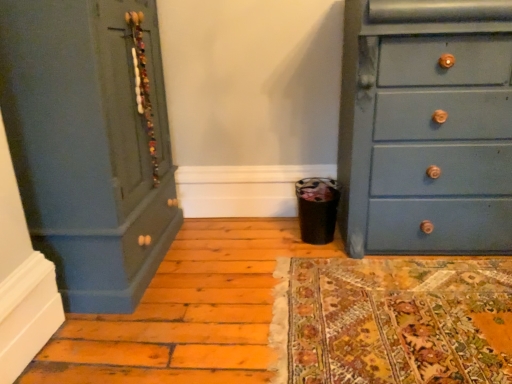
Question: Looking at the image, does matte blue dresser at right, placed as the second chest of drawers when sorted from left to right, seem bigger or smaller compared to matte blue dresser at left, positioned as the 2th chest of drawers in right-to-left order?

Choices:
 (A) big
 (B) small

Answer: (B)

Question: In terms of height, does matte blue dresser at right, marked as the first chest of drawers in a right-to-left arrangement, look taller or shorter compared to matte blue dresser at left, positioned as the 2th chest of drawers in right-to-left order?

Choices:
 (A) tall
 (B) short

Answer: (B)

Question: Relative to matte blue dresser at left, the 1th chest of drawers in the left-to-right sequence, is matte blue dresser at right, placed as the second chest of drawers when sorted from left to right, in front or behind?

Choices:
 (A) behind
 (B) front

Answer: (A)

Question: Considering the positions of point (31, 16) and point (463, 18), is point (31, 16) closer or farther from the camera than point (463, 18)?

Choices:
 (A) closer
 (B) farther

Answer: (A)

Question: In the image, is matte blue dresser at left, positioned as the 2th chest of drawers in right-to-left order, positioned in front of or behind matte blue dresser at right, placed as the second chest of drawers when sorted from left to right?

Choices:
 (A) behind
 (B) front

Answer: (B)

Question: From the image's perspective, is matte blue dresser at left, positioned as the 2th chest of drawers in right-to-left order, located above or below matte blue dresser at right, placed as the second chest of drawers when sorted from left to right?

Choices:
 (A) above
 (B) below

Answer: (B)

Question: In terms of width, does matte blue dresser at left, positioned as the 2th chest of drawers in right-to-left order, look wider or thinner when compared to matte blue dresser at right, placed as the second chest of drawers when sorted from left to right?

Choices:
 (A) thin
 (B) wide

Answer: (B)